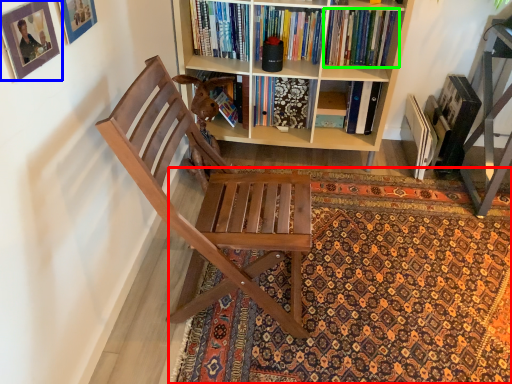
Question: Which is nearer to the mat (highlighted by a red box)? picture frame (highlighted by a blue box) or book (highlighted by a green box).

Choices:
 (A) picture frame
 (B) book

Answer: (B)